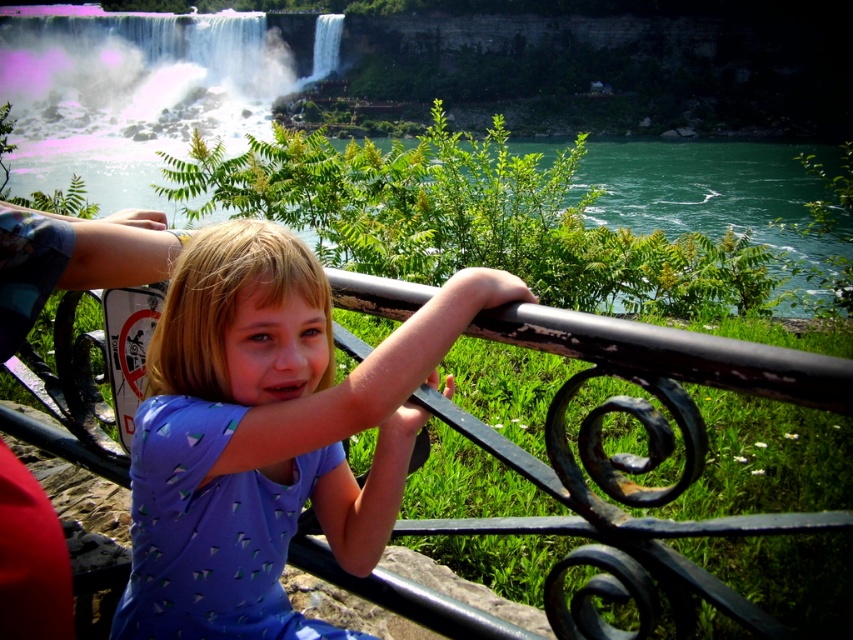
You are a photographer trying to capture the girl in the purple matte shirt at center and the white frothy water at upper left in the same frame. Based on their positions, which object is closer to the camera?

The purple matte shirt at center is closer to the camera than the white frothy water at upper left because it is shorter in the image, indicating proximity.

You are a photographer trying to capture the girl in the light purple dress. The camera is set to focus on the point at coordinates point (x=267, y=433). Will this point be on the girl?

Yes, the point (x=267, y=433) corresponds to the purple matte shirt at center, so the camera will focus on the girl in the light purple dress.